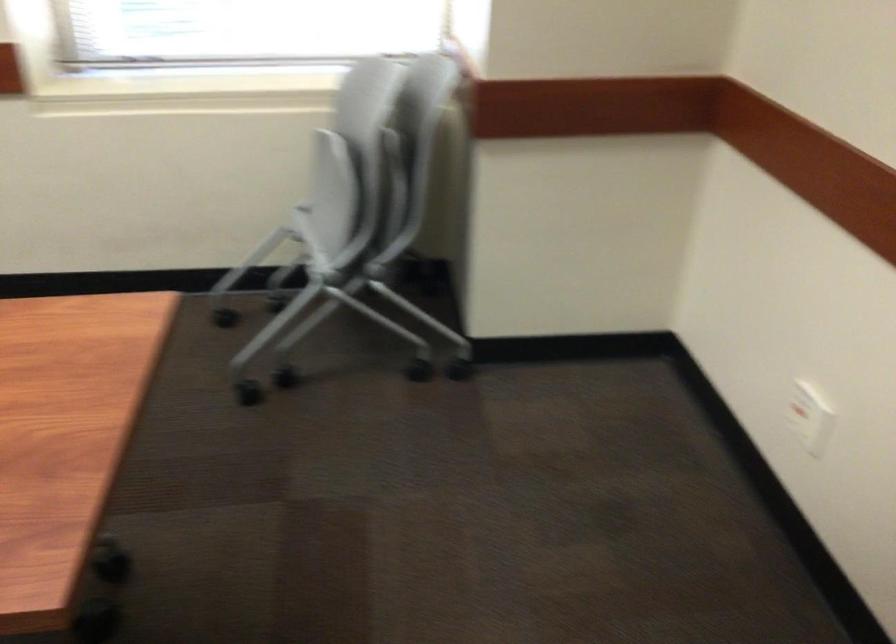
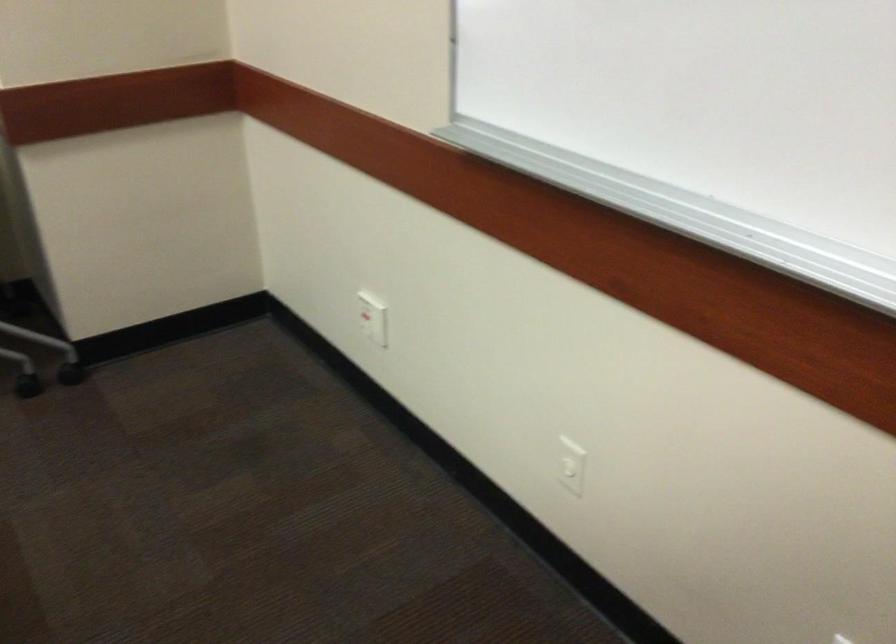
Question: Based on the continuous images, in which direction is the camera rotating? Reply with the corresponding letter.

Choices:
 (A) Left
 (B) Right
 (C) Up
 (D) Down

Answer: (B)